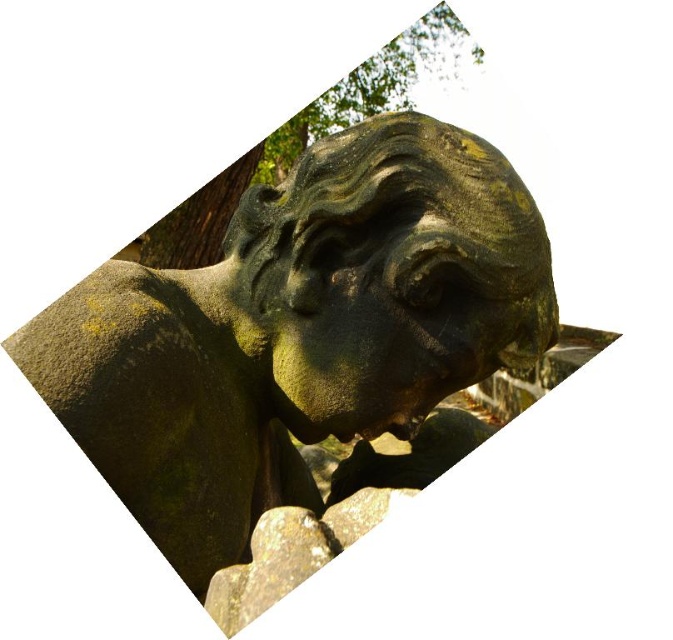
Looking at this image, you are standing in a garden and see the green stone statue at center. If you walk 0.3 meters to the north, will you be closer to the statue?

The green stone statue at center is located at point (295, 330). Walking 0.3 meters north would move you closer to the statue if the statue is north of your current position. However, without knowing your starting position relative to the statue, it is impossible to determine if moving north will bring you closer.

You are an art conservator examining the image. You need to determine which object is nearer to you. Which is closer, the green stone statue at center or the green mossy tree at upper center?

The green stone statue at center is closer to the viewer than the green mossy tree at upper center.

You are an art conservator examining the image. You need to determine the spatial relationship between the green stone statue at center and the green mossy stone head at center. Which object is positioned to the left?

The green stone statue at center is to the left of the green mossy stone head at center.